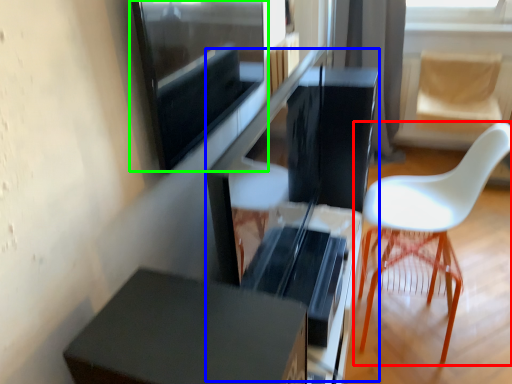
Question: Estimate the real-world distances between objects in this image. Which object is closer to chair (highlighted by a red box), computer desk (highlighted by a blue box) or window screen (highlighted by a green box)?

Choices:
 (A) computer desk
 (B) window screen

Answer: (A)